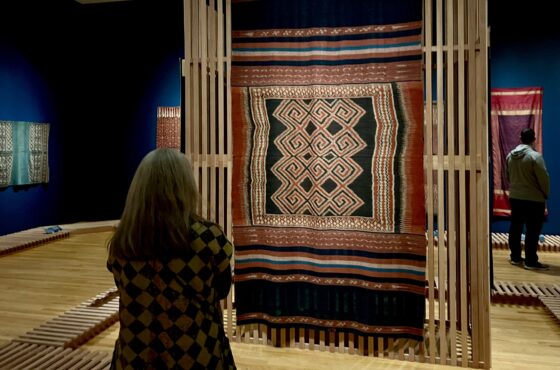
Locate an element on the screen. royal blue wall is located at coordinates (23, 57), (520, 54).